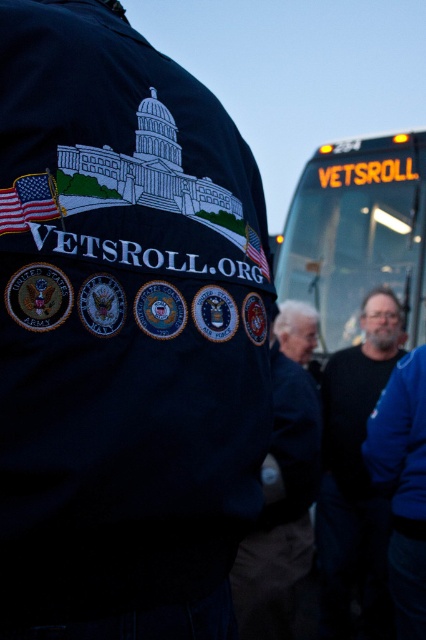
Which is below, matte black jacket at center or dark blue jacket at center?

dark blue jacket at center

Does matte black jacket at center appear over dark blue jacket at center?

Yes.

Locate an element on the screen. The image size is (426, 640). matte black jacket at center is located at coordinates (123, 333).

Can you confirm if translucent glass bus at center is positioned to the right of blue denim jacket at lower right?

Indeed, translucent glass bus at center is positioned on the right side of blue denim jacket at lower right.

Can you confirm if translucent glass bus at center is positioned to the left of blue denim jacket at lower right?

No, translucent glass bus at center is not to the left of blue denim jacket at lower right.

Which is behind, point (325, 320) or point (386, 636)?

Point (325, 320)

The width and height of the screenshot is (426, 640). I want to click on translucent glass bus at center, so [357, 234].

Is point (416, 241) more distant than point (282, 401)?

That is True.

Consider the image. Measure the distance from translucent glass bus at center to dark blue jacket at center.

translucent glass bus at center and dark blue jacket at center are 6.22 feet apart.

Image resolution: width=426 pixels, height=640 pixels. Find the location of `translucent glass bus at center`. translucent glass bus at center is located at coordinates (357, 234).

Locate an element on the screen. Image resolution: width=426 pixels, height=640 pixels. translucent glass bus at center is located at coordinates (357, 234).